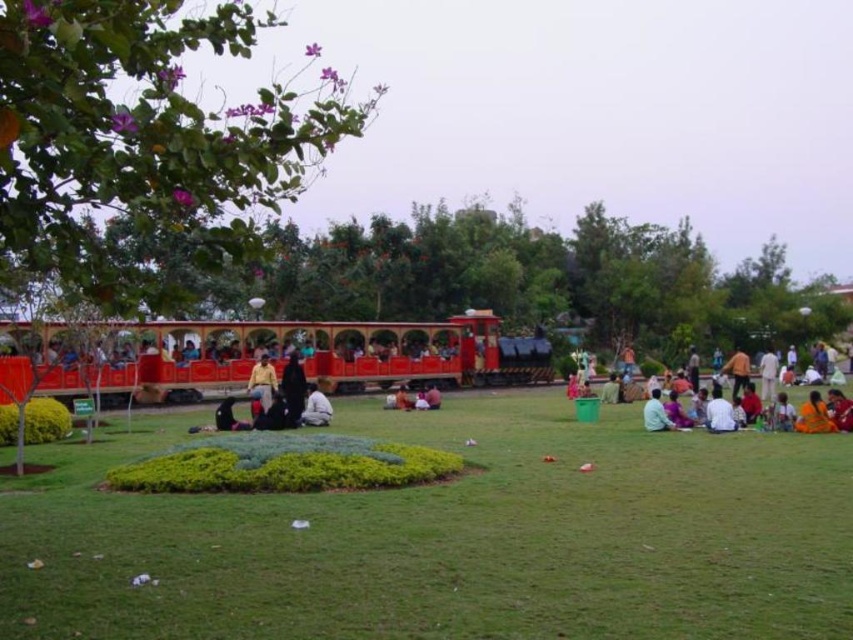
You are standing in the park and see both the green grass at center and the white cotton shirt at center. Which object is wider?

The green grass at center is wider than the white cotton shirt at center.

You are a photographer standing at the center of the grassy field. You want to take a photo of the shiny red train at center and the orange fabric person at lower right so that both are visible in the frame. Considering their heights, which object should you focus on to ensure both are in focus?

The shiny red train at center is taller than the orange fabric person at lower right. To ensure both are in focus, you should focus on the shiny red train at center since it is the taller object and will require a wider depth of field to capture both heights effectively.

What is the color of the grass at the point with coordinates (x=450, y=538)?

The grass at point (x=450, y=538) is green.